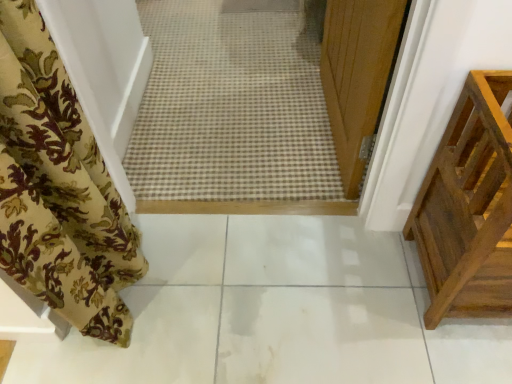
This screenshot has height=384, width=512. I want to click on free spot below floral fabric curtain at left (from a real-world perspective), so click(138, 273).